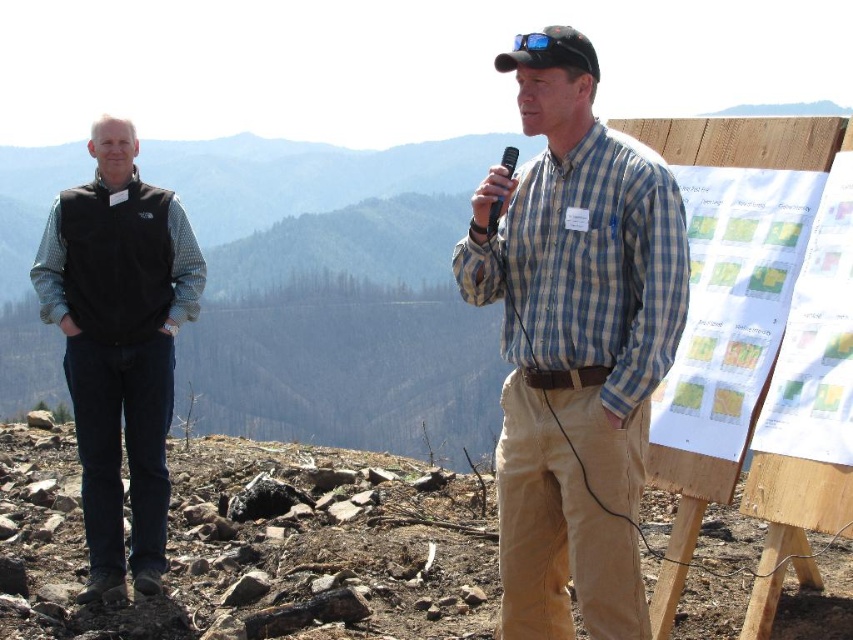
Question: Does blue plaid shirt at center appear over black fleece vest at left?

Choices:
 (A) no
 (B) yes

Answer: (B)

Question: Which object appears closest to the camera in this image?

Choices:
 (A) black fleece vest at left
 (B) blue plaid shirt at center

Answer: (B)

Question: Is blue plaid shirt at center to the left of black fleece vest at left from the viewer's perspective?

Choices:
 (A) yes
 (B) no

Answer: (B)

Question: Does blue plaid shirt at center lie in front of black fleece vest at left?

Choices:
 (A) yes
 (B) no

Answer: (A)